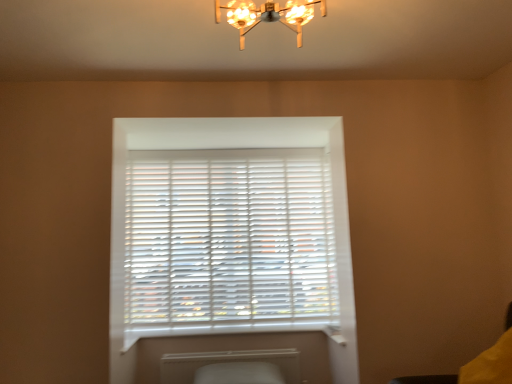
Question: Is metallic chandelier at upper center smaller than white matte radiator at lower center?

Choices:
 (A) no
 (B) yes

Answer: (A)

Question: From the image's perspective, is metallic chandelier at upper center below white matte radiator at lower center?

Choices:
 (A) yes
 (B) no

Answer: (B)

Question: From a real-world perspective, is metallic chandelier at upper center positioned over white matte radiator at lower center based on gravity?

Choices:
 (A) no
 (B) yes

Answer: (B)

Question: Is metallic chandelier at upper center outside white matte radiator at lower center?

Choices:
 (A) no
 (B) yes

Answer: (B)

Question: Is the position of metallic chandelier at upper center more distant than that of white matte radiator at lower center?

Choices:
 (A) no
 (B) yes

Answer: (A)

Question: From their relative heights in the image, would you say yellow fabric swivel chair at lower right is taller or shorter than white matte blinds at center?

Choices:
 (A) tall
 (B) short

Answer: (B)

Question: From the image's perspective, is yellow fabric swivel chair at lower right positioned above or below white matte blinds at center?

Choices:
 (A) below
 (B) above

Answer: (A)

Question: In the image, is yellow fabric swivel chair at lower right on the left side or the right side of white matte blinds at center?

Choices:
 (A) right
 (B) left

Answer: (A)

Question: Is yellow fabric swivel chair at lower right inside or outside of white matte blinds at center?

Choices:
 (A) outside
 (B) inside

Answer: (A)

Question: Considering the positions of point click(156, 327) and point click(219, 357), is point click(156, 327) closer or farther from the camera than point click(219, 357)?

Choices:
 (A) closer
 (B) farther

Answer: (B)

Question: Is white plastic window sill at lower center in front of or behind white matte radiator at lower center in the image?

Choices:
 (A) behind
 (B) front

Answer: (A)

Question: From their relative heights in the image, would you say white plastic window sill at lower center is taller or shorter than white matte radiator at lower center?

Choices:
 (A) short
 (B) tall

Answer: (A)

Question: Considering the positions of white plastic window sill at lower center and white matte radiator at lower center in the image, is white plastic window sill at lower center bigger or smaller than white matte radiator at lower center?

Choices:
 (A) big
 (B) small

Answer: (B)

Question: Do you think white matte radiator at lower center is within metallic chandelier at upper center, or outside of it?

Choices:
 (A) inside
 (B) outside

Answer: (B)

Question: In terms of size, does white matte radiator at lower center appear bigger or smaller than metallic chandelier at upper center?

Choices:
 (A) big
 (B) small

Answer: (B)